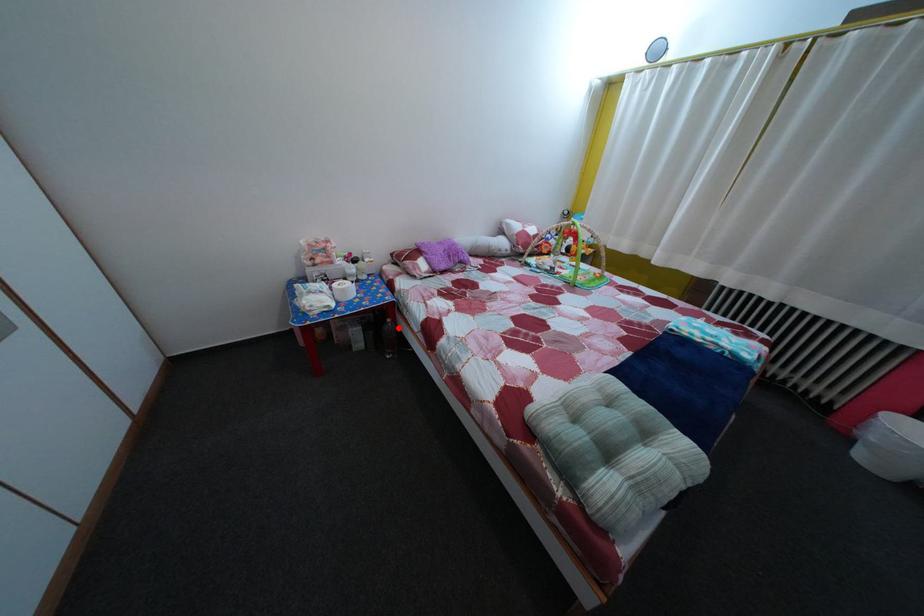
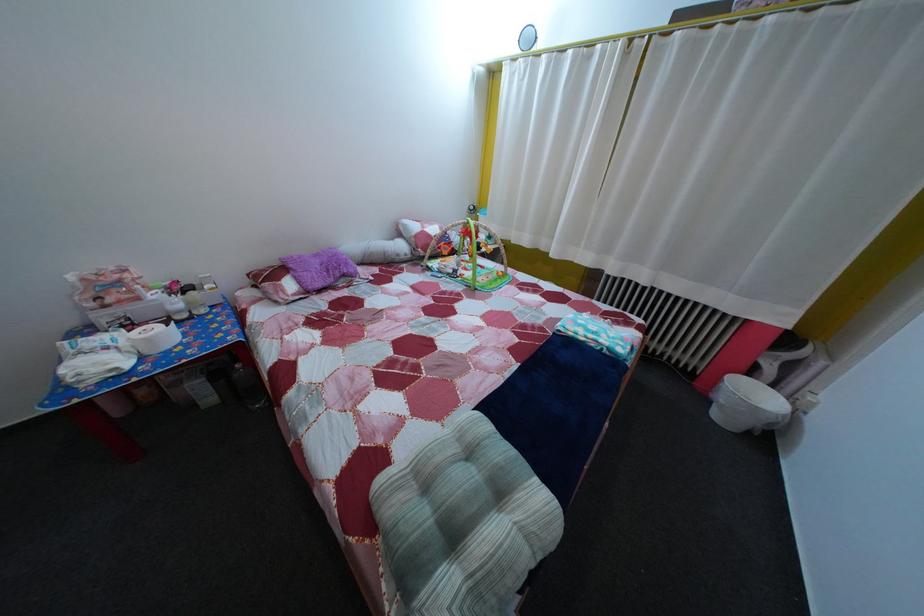
Find the pixel in the second image that matches the highlighted location in the first image.

(248, 374)